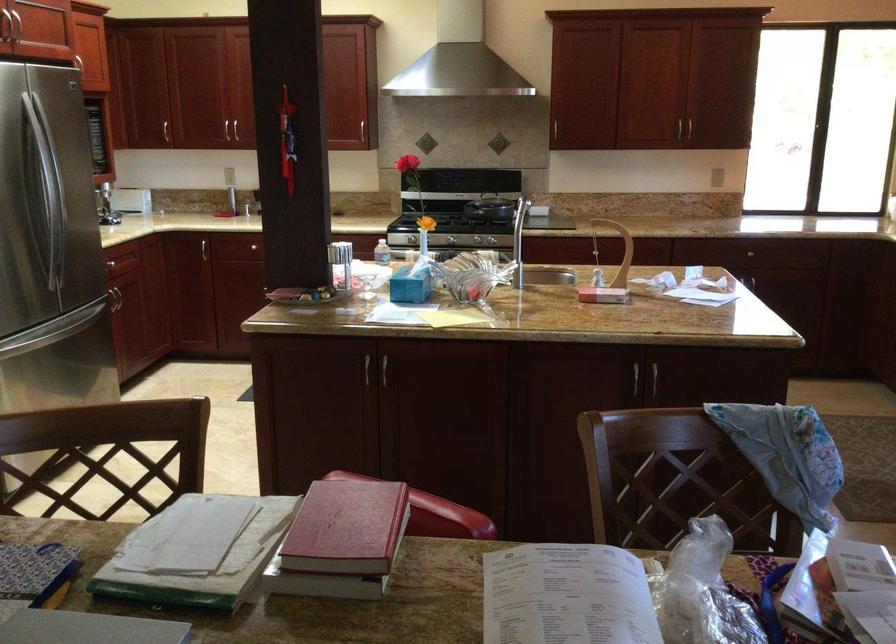
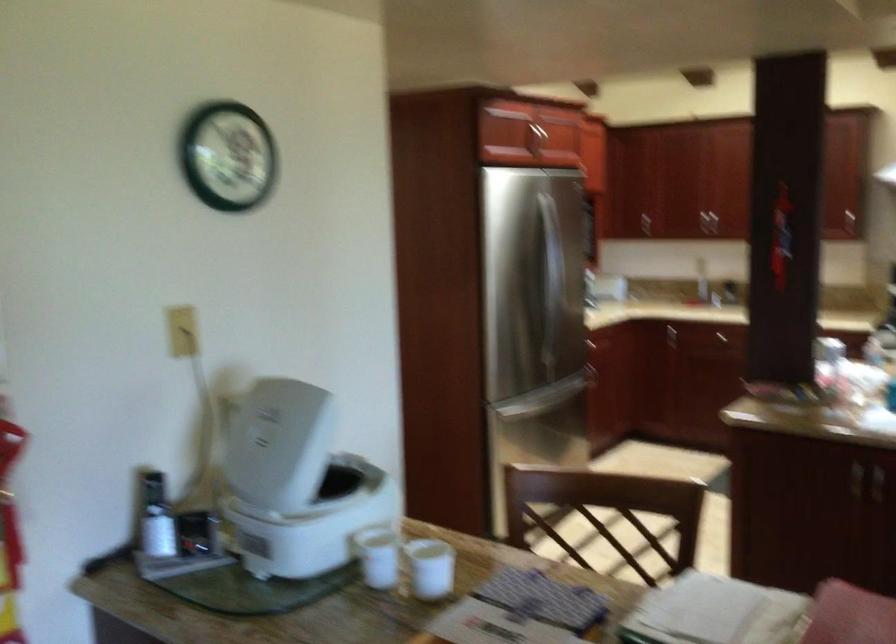
Question: The first image is from the beginning of the video and the second image is from the end. How did the camera likely rotate when shooting the video?

Choices:
 (A) Left
 (B) Right
 (C) Up
 (D) Down

Answer: (A)